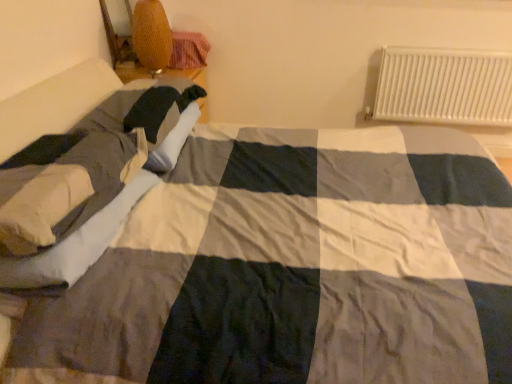
Question: Does white metal radiator at upper right have a smaller size compared to soft beige pillow at left?

Choices:
 (A) no
 (B) yes

Answer: (B)

Question: From the image's perspective, is white metal radiator at upper right on top of soft beige pillow at left?

Choices:
 (A) no
 (B) yes

Answer: (B)

Question: Is white metal radiator at upper right facing towards soft beige pillow at left?

Choices:
 (A) yes
 (B) no

Answer: (B)

Question: From the image's perspective, is white metal radiator at upper right located beneath soft beige pillow at left?

Choices:
 (A) no
 (B) yes

Answer: (A)

Question: Is white metal radiator at upper right facing away from soft beige pillow at left?

Choices:
 (A) no
 (B) yes

Answer: (A)

Question: Does white metal radiator at upper right lie behind soft beige pillow at left?

Choices:
 (A) no
 (B) yes

Answer: (B)

Question: Can you confirm if white metal radiator at upper right is positioned to the right of woven wicker lampshade at upper left?

Choices:
 (A) no
 (B) yes

Answer: (B)

Question: Does white metal radiator at upper right have a lesser width compared to woven wicker lampshade at upper left?

Choices:
 (A) no
 (B) yes

Answer: (B)

Question: Is white metal radiator at upper right further to the viewer compared to woven wicker lampshade at upper left?

Choices:
 (A) no
 (B) yes

Answer: (B)

Question: Does white metal radiator at upper right touch woven wicker lampshade at upper left?

Choices:
 (A) no
 (B) yes

Answer: (A)

Question: Can you confirm if white metal radiator at upper right is bigger than woven wicker lampshade at upper left?

Choices:
 (A) no
 (B) yes

Answer: (B)

Question: Is white metal radiator at upper right wider than woven wicker lampshade at upper left?

Choices:
 (A) no
 (B) yes

Answer: (A)

Question: Considering the relative positions of soft beige pillow at left and woven wicker lampshade at upper left in the image provided, is soft beige pillow at left to the right of woven wicker lampshade at upper left from the viewer's perspective?

Choices:
 (A) no
 (B) yes

Answer: (A)